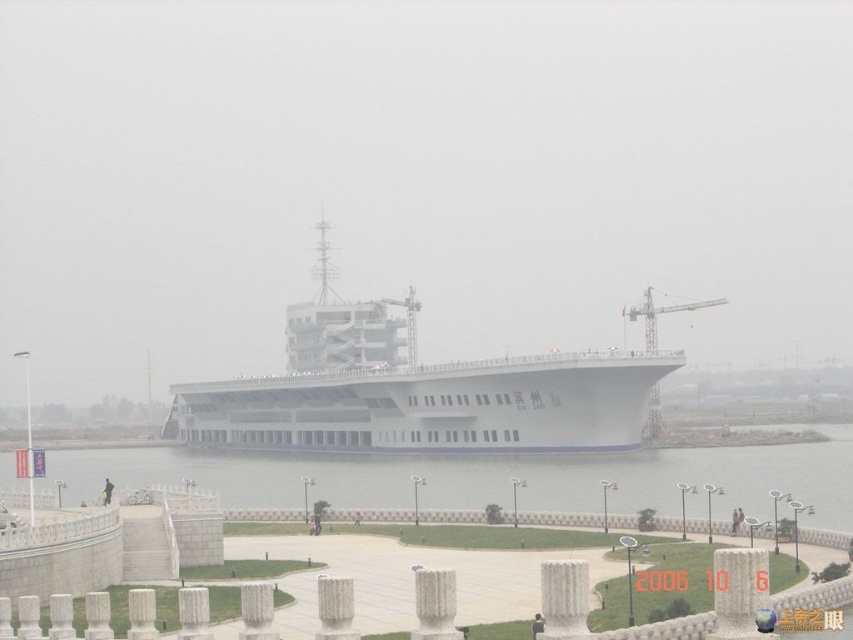
Is white matte aircraft carrier at center taller than clear water at lower center?

Indeed, white matte aircraft carrier at center has a greater height compared to clear water at lower center.

Does white matte aircraft carrier at center lie behind clear water at lower center?

Yes, it is behind clear water at lower center.

What are the coordinates of `white matte aircraft carrier at center` in the screenshot? It's located at (415, 392).

The image size is (853, 640). What are the coordinates of `white matte aircraft carrier at center` in the screenshot? It's located at (415, 392).